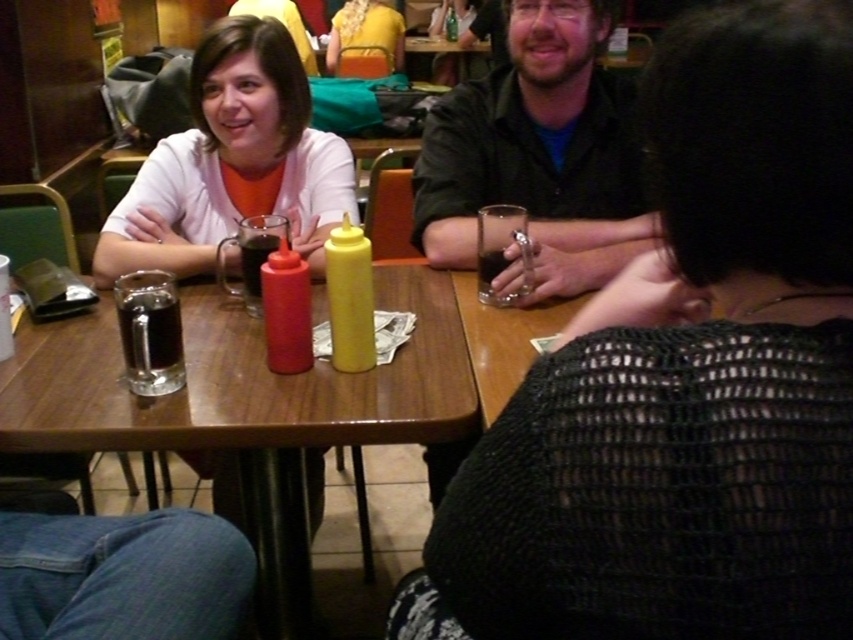
You are a customer sitting at the wooden table at center. You want to reach the dark matte glass at center to take a sip. Is the glass within easy reach from your current position?

The wooden table at center is closer to the viewer than dark matte glass at center, so the glass is farther away and may not be easily reachable without moving closer.

In the scene shown: You are standing at the entrance of the restaurant and want to sit at the wooden table at center. According to the coordinates provided, in which direction should you walk to reach it?

The wooden table at center is located at coordinates point (247, 406), so you should walk towards the direction of the center of the image to reach it.

You are a customer sitting at the table in the foreground. You want to place your phone on the table so that it is as close as possible to the point labeled as point (686, 380). However, there is a red ketchup bottle and a yellow mustard bottle already on the table. Where should you place your phone to be closest to the point while avoiding the bottles?

Place the phone near the point (686, 380) but away from the red ketchup bottle and yellow mustard bottle. Since the point is on the knitted black sweater at center, ensure the phone is positioned closest to that area without overlapping the bottles.